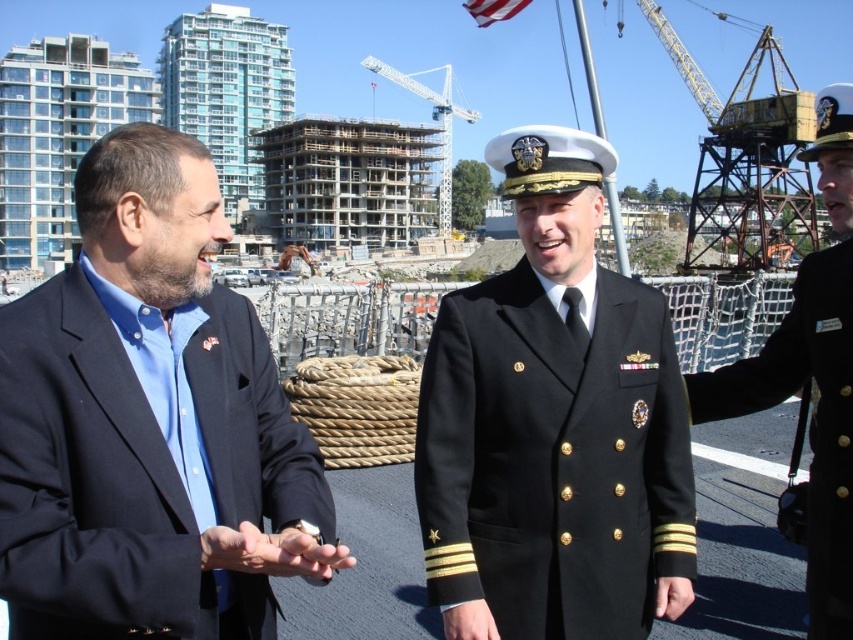
Does blue fabric shirt at left have a smaller size compared to black uniform at center?

Yes, blue fabric shirt at left is smaller than black uniform at center.

From the picture: Between blue fabric shirt at left and black uniform at center, which one is positioned higher?

Positioned higher is black uniform at center.

In order to click on blue fabric shirt at left in this screenshot , I will do `click(149, 422)`.

Does point (306, 506) come behind point (445, 378)?

No, it is not.

Where is `blue fabric shirt at left`? blue fabric shirt at left is located at coordinates (149, 422).

At what (x,y) coordinates should I click in order to perform the action: click on blue fabric shirt at left. Please return your answer as a coordinate pair (x, y). This screenshot has height=640, width=853. Looking at the image, I should click on (149, 422).

Can you confirm if black woolen military uniform at center is smaller than black uniform at center?

Correct, black woolen military uniform at center occupies less space than black uniform at center.

Who is higher up, black woolen military uniform at center or black uniform at center?

black uniform at center is higher up.

Is point (589, 573) less distant than point (839, 342)?

Yes, it is.

Identify the location of black woolen military uniform at center. (554, 426).